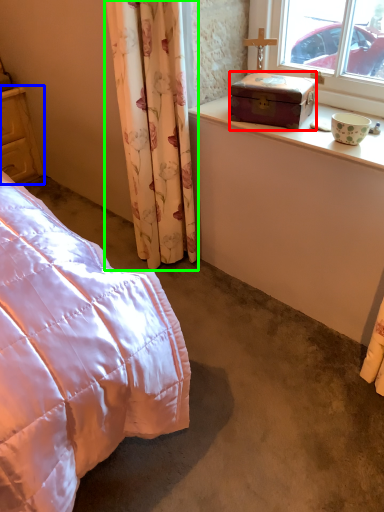
Question: Which object is the farthest from box (highlighted by a red box)? Choose among these: cupboard (highlighted by a blue box) or curtain (highlighted by a green box).

Choices:
 (A) cupboard
 (B) curtain

Answer: (A)